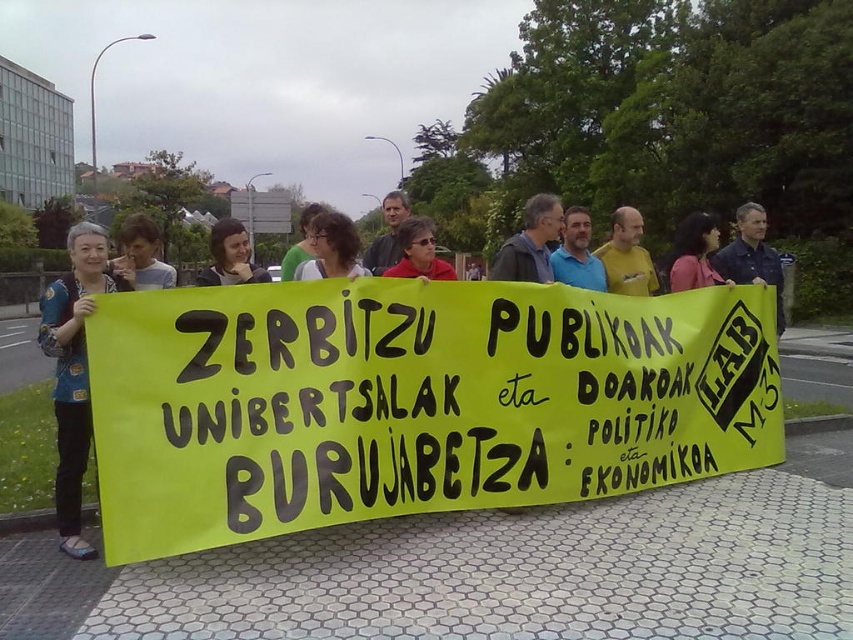
Consider the image. You are a photographer trying to capture the protest scene. You notice two points in the image at coordinates point (517, 262) and point (709, 276). Which point is closer to your camera lens?

Point (517, 262) is closer to the camera than point (709, 276).

You are a photographer trying to capture a photo of the protesters. You notice two shirts at the center of the group, a matte black shirt at center and a dark gray shirt at center. Which shirt should you focus on if you want to include both shirts in the frame without cropping the tops?

You should focus on the dark gray shirt at center because it is taller than the matte black shirt at center, allowing more space at the top of the frame to include both shirts without cropping.